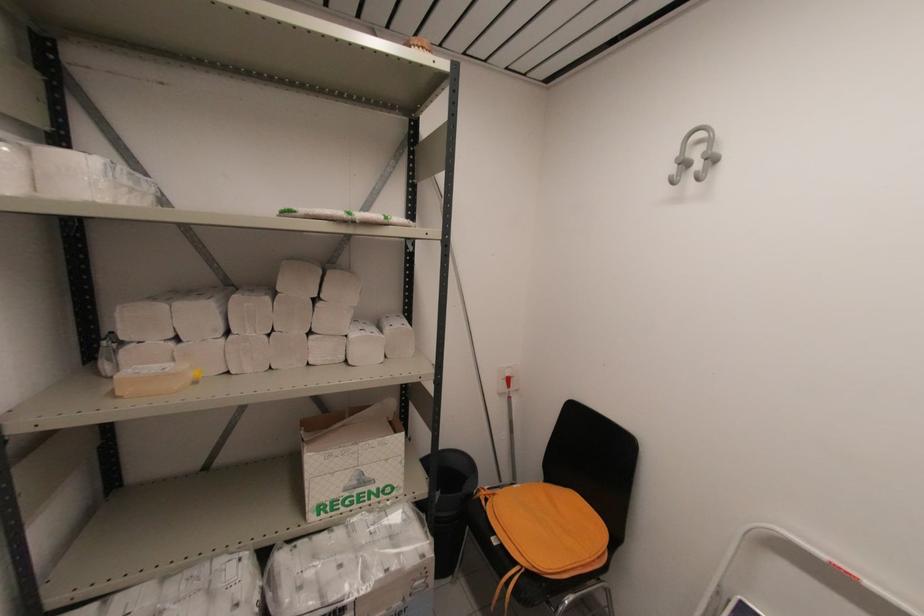
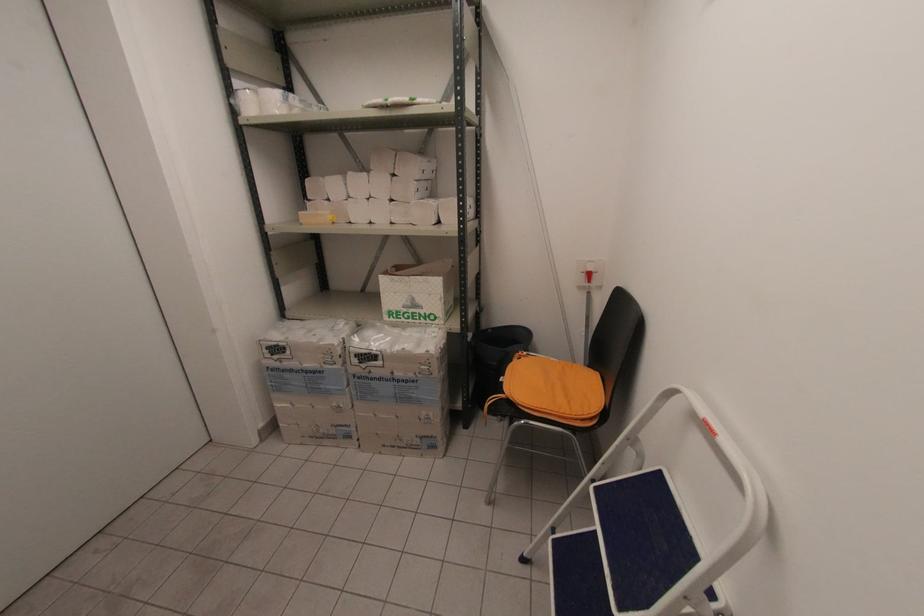
Question: Based on the continuous images, in which direction is the camera rotating? Reply with the corresponding letter.

Choices:
 (A) Left
 (B) Right
 (C) Up
 (D) Down

Answer: (A)